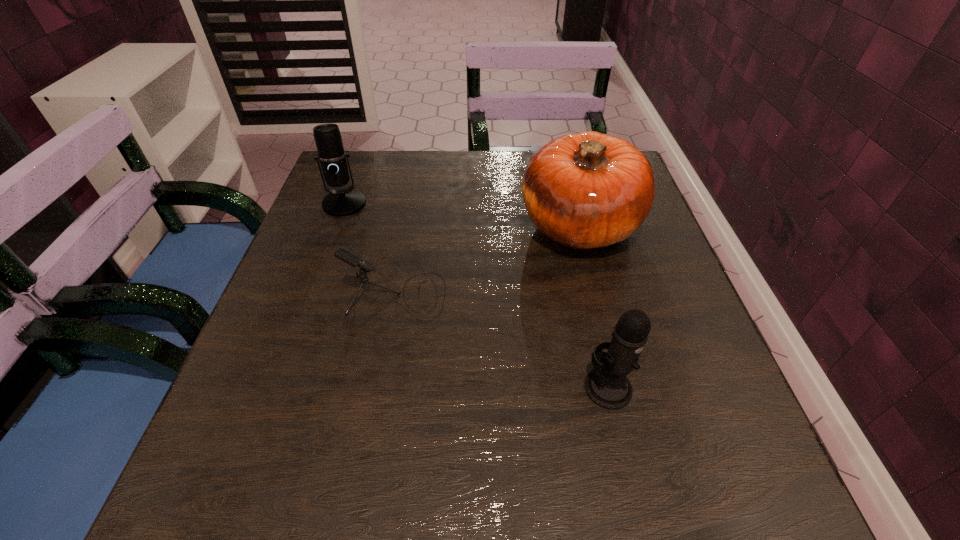
The width and height of the screenshot is (960, 540). I want to click on free space located 0.350m on the stand of the second microphone from right to left, so click(627, 295).

The image size is (960, 540). What are the coordinates of `pumpkin that is positioned at the far edge` in the screenshot? It's located at (587, 190).

This screenshot has width=960, height=540. I want to click on microphone at the far edge, so click(x=332, y=164).

Where is `pumpkin that is at the right edge`? pumpkin that is at the right edge is located at coordinates (587, 190).

This screenshot has height=540, width=960. In order to click on microphone located in the right edge section of the desktop in this screenshot , I will do `click(606, 385)`.

At what (x,y) coordinates should I click in order to perform the action: click on object located at the far left corner. Please return your answer as a coordinate pair (x, y). Looking at the image, I should click on (332, 164).

Find the location of a particular element. This screenshot has width=960, height=540. object that is at the far right corner is located at coordinates (587, 190).

Identify the location of free spot at the far edge of the desktop. pyautogui.click(x=432, y=162).

Find the location of a particular element. This screenshot has height=540, width=960. free space at the near edge is located at coordinates (612, 485).

What are the coordinates of `vacant space at the left edge of the desktop` in the screenshot? It's located at (243, 417).